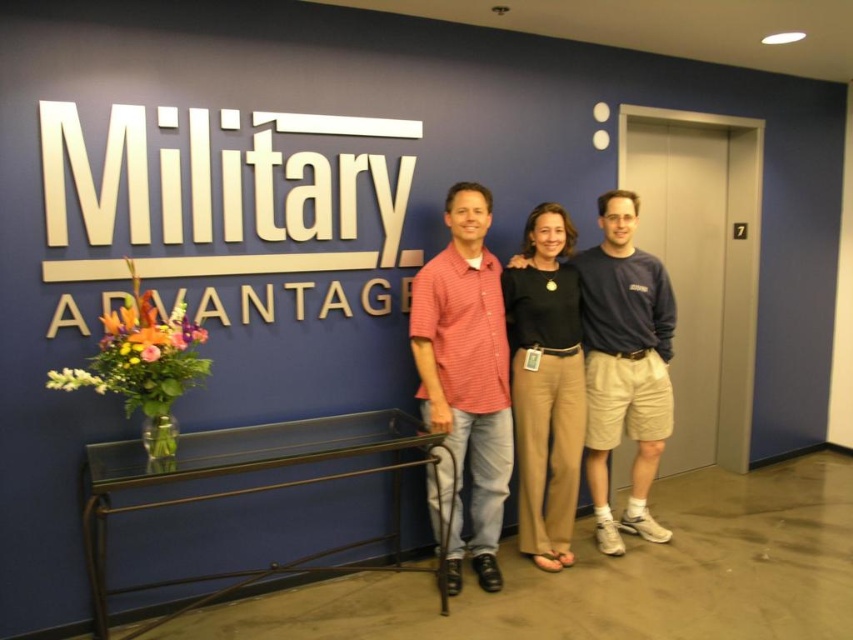
Looking at the two men in the image, which one is wearing a shirt with a smaller width? The man on the left is wearing a red checkered shirt at center, and the man on the right is wearing a blue cotton shirt at center. Which shirt has a smaller width?

The red checkered shirt at center has a smaller width compared to the blue cotton shirt at center.

You are a photographer adjusting the lighting for a group photo. You notice the red checkered shirt at center and the blue cotton shirt at center. Which shirt should you focus the light on to ensure it stands out more due to its size?

The red checkered shirt at center is larger in size than the blue cotton shirt at center, so focusing the light on the red checkered shirt at center will make it stand out more due to its size.

You are a photographer adjusting your camera settings. You notice two points in the scene at coordinates point (601, 419) and point (521, 458). Which point is closer to your camera lens?

Point (601, 419) is further to the camera than point (521, 458), so the point closer to the camera lens is point (521, 458).